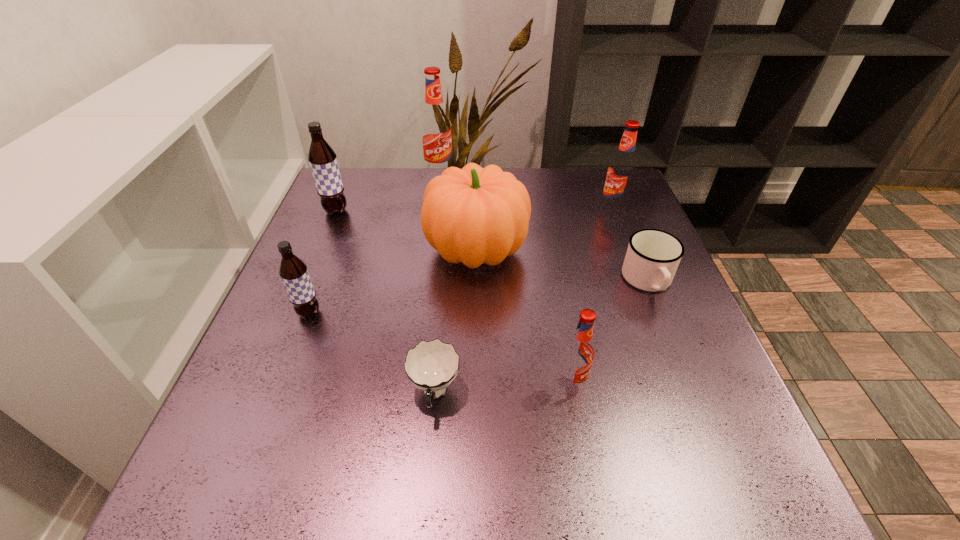
At what (x,y) coordinates should I click in order to perform the action: click on free space between the farthest red root beer and the white cup. Please return your answer as a coordinate pair (x, y). The height and width of the screenshot is (540, 960). Looking at the image, I should click on (437, 284).

In order to click on free space between the fourth farthest root beer and the shortest object in this screenshot , I will do `click(372, 353)`.

This screenshot has width=960, height=540. In order to click on free space between the farthest object and the smaller brown root beer in this screenshot , I will do `click(374, 244)`.

In order to click on empty location between the leftmost red root beer and the nearer brown root beer in this screenshot , I will do `click(374, 244)`.

Locate an element on the screen. The width and height of the screenshot is (960, 540). free area in between the nearest red root beer and the bigger brown root beer is located at coordinates [x=454, y=297].

The image size is (960, 540). What are the coordinates of `free spot between the nearest red root beer and the pumpkin` in the screenshot? It's located at (524, 317).

At what (x,y) coordinates should I click in order to perform the action: click on free space between the tallest root beer and the bigger brown root beer. Please return your answer as a coordinate pair (x, y). Looking at the image, I should click on (388, 193).

Locate an element on the screen. free spot between the pumpkin and the smaller brown root beer is located at coordinates (393, 282).

At what (x,y) coordinates should I click in order to perform the action: click on object that stands as the fifth closest to the nearest root beer. Please return your answer as a coordinate pair (x, y). Looking at the image, I should click on (621, 171).

The image size is (960, 540). I want to click on the seventh closest object relative to the tallest object, so [x=579, y=351].